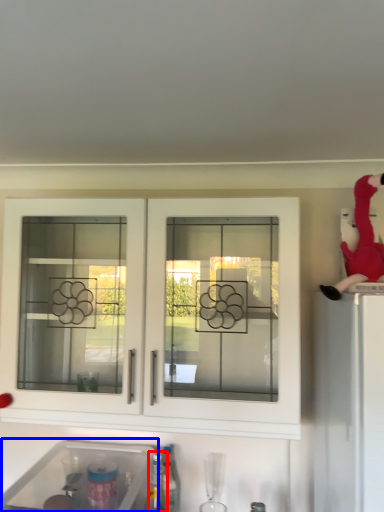
Question: Among these objects, which one is farthest to the camera, bottle (highlighted by a red box) or sink (highlighted by a blue box)?

Choices:
 (A) bottle
 (B) sink

Answer: (A)